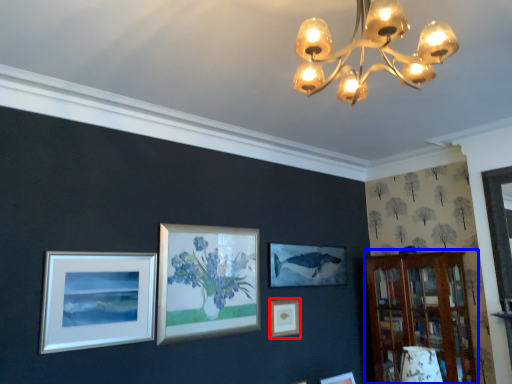
Question: Among these objects, which one is farthest to the camera, picture frame (highlighted by a red box) or bookshelf (highlighted by a blue box)?

Choices:
 (A) picture frame
 (B) bookshelf

Answer: (A)